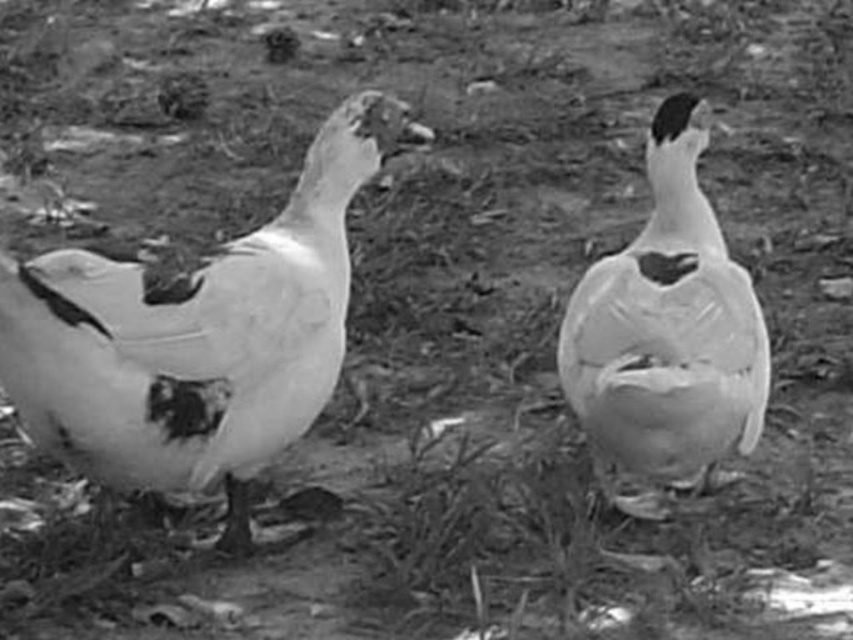
Is point (10, 369) positioned after point (683, 316)?

No, (10, 369) is in front of (683, 316).

Who is more forward, [173,355] or [709,355]?

Point [173,355] is more forward.

Locate an element on the screen. Image resolution: width=853 pixels, height=640 pixels. white matte goose at left is located at coordinates [195, 337].